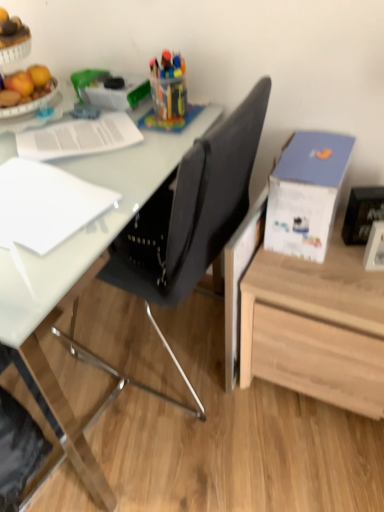
What do you see at coordinates (375, 248) in the screenshot? The image size is (384, 512). I see `white glossy picture frame at lower right, which is the 1th picture frame in bottom-to-top order` at bounding box center [375, 248].

In order to click on black glossy picture frame at upper right, which is the 2th picture frame in bottom-to-top order in this screenshot , I will do `click(362, 213)`.

Describe the element at coordinates (191, 211) in the screenshot. I see `black fabric chair at center` at that location.

Identify the location of white paper at upper left, the first notebook when ordered from back to front. (79, 137).

In terms of width, does black glossy picture frame at upper right, which is the 2th picture frame in bottom-to-top order, look wider or thinner when compared to white paper at upper left, the second notebook positioned from the front?

Clearly, black glossy picture frame at upper right, which is the 2th picture frame in bottom-to-top order, has less width compared to white paper at upper left, the second notebook positioned from the front.

From the image's perspective, between black glossy picture frame at upper right, which is the 2th picture frame in bottom-to-top order, and white paper at upper left, the first notebook when ordered from back to front, who is located below?

From the image's view, black glossy picture frame at upper right, which is the 2th picture frame in bottom-to-top order, is below.

Based on their positions, is black glossy picture frame at upper right, the first picture frame viewed from the top, located to the left or right of white paper at upper left, the second notebook positioned from the front?

In the image, black glossy picture frame at upper right, the first picture frame viewed from the top, appears on the right side of white paper at upper left, the second notebook positioned from the front.

Does black glossy picture frame at upper right, which is the 2th picture frame in bottom-to-top order, have a lesser height compared to white paper at upper left, the first notebook when ordered from back to front?

Incorrect, the height of black glossy picture frame at upper right, which is the 2th picture frame in bottom-to-top order, does not fall short of that of white paper at upper left, the first notebook when ordered from back to front.

Considering the positions of objects white glossy picture frame at lower right, positioned as the 2th picture frame in top-to-bottom order, and black glossy picture frame at upper right, which is the 2th picture frame in bottom-to-top order, in the image provided, who is more to the right, white glossy picture frame at lower right, positioned as the 2th picture frame in top-to-bottom order, or black glossy picture frame at upper right, which is the 2th picture frame in bottom-to-top order,?

From the viewer's perspective, white glossy picture frame at lower right, positioned as the 2th picture frame in top-to-bottom order, appears more on the right side.

Is white glossy picture frame at lower right, which is the 1th picture frame in bottom-to-top order, bigger than black glossy picture frame at upper right, the first picture frame viewed from the top?

No, white glossy picture frame at lower right, which is the 1th picture frame in bottom-to-top order, is not bigger than black glossy picture frame at upper right, the first picture frame viewed from the top.

From a real-world perspective, is white glossy picture frame at lower right, positioned as the 2th picture frame in top-to-bottom order, physically located above or below black glossy picture frame at upper right, which is the 2th picture frame in bottom-to-top order?

In terms of real-world spatial position, white glossy picture frame at lower right, positioned as the 2th picture frame in top-to-bottom order, is below black glossy picture frame at upper right, which is the 2th picture frame in bottom-to-top order.

Does white glossy picture frame at lower right, which is the 1th picture frame in bottom-to-top order, have a lesser width compared to black glossy picture frame at upper right, the first picture frame viewed from the top?

Yes, white glossy picture frame at lower right, which is the 1th picture frame in bottom-to-top order, is thinner than black glossy picture frame at upper right, the first picture frame viewed from the top.

Does black glossy picture frame at upper right, the first picture frame viewed from the top, lie behind white glossy picture frame at lower right, positioned as the 2th picture frame in top-to-bottom order?

Yes, black glossy picture frame at upper right, the first picture frame viewed from the top, is further from the viewer.

Is black glossy picture frame at upper right, which is the 2th picture frame in bottom-to-top order, at the right side of white glossy picture frame at lower right, positioned as the 2th picture frame in top-to-bottom order?

No.

This screenshot has width=384, height=512. What are the coordinates of `picture frame that is behind the white glossy picture frame at lower right, positioned as the 2th picture frame in top-to-bottom order` in the screenshot? It's located at (362, 213).

Which object is positioned more to the left, black glossy picture frame at upper right, which is the 2th picture frame in bottom-to-top order, or blue cardboard box at upper right?

blue cardboard box at upper right.

Are black glossy picture frame at upper right, the first picture frame viewed from the top, and blue cardboard box at upper right far apart?

No.

How different are the orientations of black glossy picture frame at upper right, the first picture frame viewed from the top, and blue cardboard box at upper right in degrees?

black glossy picture frame at upper right, the first picture frame viewed from the top, and blue cardboard box at upper right are facing 23.3 degrees away from each other.

Does point (367, 206) come behind point (282, 187)?

That is True.

Is the position of white paper at upper left, placed as the 2th notebook when sorted from bottom to top, more distant than that of white paper at left, which appears as the first notebook when viewed from the front?

Yes, the depth of white paper at upper left, placed as the 2th notebook when sorted from bottom to top, is greater than that of white paper at left, which appears as the first notebook when viewed from the front.

Considering the relative positions of white paper at upper left, the first notebook when ordered from back to front, and white paper at left, which ranks as the second notebook in back-to-front order, in the image provided, is white paper at upper left, the first notebook when ordered from back to front, to the left or to the right of white paper at left, which ranks as the second notebook in back-to-front order,?

white paper at upper left, the first notebook when ordered from back to front, is positioned on white paper at left, which ranks as the second notebook in back-to-front order,'s left side.

From a real-world perspective, is white paper at upper left, acting as the 1th notebook starting from the top, on top of white paper at left, which ranks as the second notebook in back-to-front order?

Yes, from a real-world perspective, white paper at upper left, acting as the 1th notebook starting from the top, is over white paper at left, which ranks as the second notebook in back-to-front order

Which is closer, (x=182, y=170) or (x=64, y=222)?

Clearly, point (x=182, y=170) is closer to the camera than point (x=64, y=222).

Locate an element on the screen. Image resolution: width=384 pixels, height=512 pixels. notebook that is the 1st one when counting backward from the black fabric chair at center is located at coordinates (46, 204).

Which object is more forward, black fabric chair at center or white paper at left, which ranks as the second notebook in back-to-front order?

black fabric chair at center is closer to the camera.

Considering the sizes of objects black fabric chair at center and white paper at left, which is the first notebook in bottom-to-top order, in the image provided, who is wider, black fabric chair at center or white paper at left, which is the first notebook in bottom-to-top order,?

Wider between the two is black fabric chair at center.

Where is `the 2nd notebook positioned above the black fabric chair at center (from the image's perspective)`? Image resolution: width=384 pixels, height=512 pixels. the 2nd notebook positioned above the black fabric chair at center (from the image's perspective) is located at coordinates (79, 137).

Is white paper at upper left, the second notebook positioned from the front, far from black fabric chair at center?

No, white paper at upper left, the second notebook positioned from the front, is in close proximity to black fabric chair at center.

Which is in front, point (99, 124) or point (222, 143)?

The point (222, 143) is in front.

Choose the correct answer: Is white paper at upper left, acting as the 1th notebook starting from the top, inside black fabric chair at center or outside it?

white paper at upper left, acting as the 1th notebook starting from the top, lies within the bounds of black fabric chair at center.

The height and width of the screenshot is (512, 384). What are the coordinates of `the 1st picture frame counting from the right side of the white paper at upper left, placed as the 2th notebook when sorted from bottom to top` in the screenshot? It's located at (362, 213).

Where is `picture frame on the left side of white glossy picture frame at lower right, which is the 1th picture frame in bottom-to-top order`? Image resolution: width=384 pixels, height=512 pixels. picture frame on the left side of white glossy picture frame at lower right, which is the 1th picture frame in bottom-to-top order is located at coordinates (362, 213).

Estimate the real-world distances between objects in this image. Which object is closer to black glossy picture frame at upper right, which is the 2th picture frame in bottom-to-top order, white paper at left, which is the first notebook in bottom-to-top order, or white paper at upper left, the first notebook when ordered from back to front?

white paper at upper left, the first notebook when ordered from back to front, is positioned closer to the anchor black glossy picture frame at upper right, which is the 2th picture frame in bottom-to-top order.

Considering their positions, is black glossy picture frame at upper right, the first picture frame viewed from the top, positioned closer to blue cardboard box at upper right than white paper at left, which ranks as the second notebook in back-to-front order?

black glossy picture frame at upper right, the first picture frame viewed from the top, is closer to blue cardboard box at upper right.

Estimate the real-world distances between objects in this image. Which object is further from white paper at left, which ranks as the second notebook in back-to-front order, white glossy picture frame at lower right, which is the 1th picture frame in bottom-to-top order, or black fabric chair at center?

white glossy picture frame at lower right, which is the 1th picture frame in bottom-to-top order, is further to white paper at left, which ranks as the second notebook in back-to-front order.

Based on their spatial positions, is blue cardboard box at upper right or black fabric chair at center closer to white paper at upper left, placed as the 2th notebook when sorted from bottom to top?

black fabric chair at center is closer to white paper at upper left, placed as the 2th notebook when sorted from bottom to top.

Considering their positions, is black fabric chair at center positioned further to white glossy picture frame at lower right, which is the 1th picture frame in bottom-to-top order, than black glossy picture frame at upper right, the first picture frame viewed from the top?

black fabric chair at center is further to white glossy picture frame at lower right, which is the 1th picture frame in bottom-to-top order.

From the image, which object appears to be nearer to black fabric chair at center, black glossy picture frame at upper right, the first picture frame viewed from the top, or white paper at left, which is the first notebook in bottom-to-top order?

Among the two, white paper at left, which is the first notebook in bottom-to-top order, is located nearer to black fabric chair at center.

Looking at the image, which one is located further to black glossy picture frame at upper right, the first picture frame viewed from the top, white glossy picture frame at lower right, which is the 1th picture frame in bottom-to-top order, or black fabric chair at center?

black fabric chair at center is positioned further to the anchor black glossy picture frame at upper right, the first picture frame viewed from the top.

Based on their spatial positions, is black glossy picture frame at upper right, the first picture frame viewed from the top, or white paper at left, which is the first notebook in bottom-to-top order, further from white paper at upper left, the first notebook when ordered from back to front?

Based on the image, black glossy picture frame at upper right, the first picture frame viewed from the top, appears to be further to white paper at upper left, the first notebook when ordered from back to front.

Locate an element on the screen. This screenshot has width=384, height=512. chair situated between white paper at upper left, the first notebook when ordered from back to front, and black glossy picture frame at upper right, the first picture frame viewed from the top, from left to right is located at coordinates (191, 211).

Find the location of a particular element. chair located between white paper at left, acting as the second notebook starting from the top, and black glossy picture frame at upper right, the first picture frame viewed from the top, in the left-right direction is located at coordinates (191, 211).

Find the location of a particular element. This screenshot has height=512, width=384. notebook located between white paper at upper left, acting as the 1th notebook starting from the top, and blue cardboard box at upper right in the left-right direction is located at coordinates (46, 204).

Locate an element on the screen. The height and width of the screenshot is (512, 384). box between black fabric chair at center and black glossy picture frame at upper right, the first picture frame viewed from the top, in the horizontal direction is located at coordinates (306, 193).